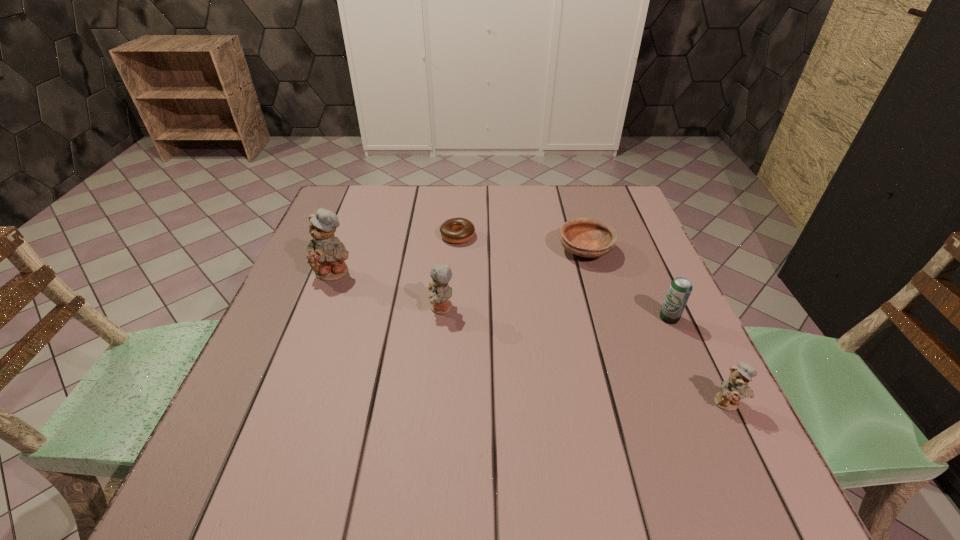
Find the location of a particular element. This screenshot has width=960, height=540. teddy bear present at the right edge is located at coordinates (736, 387).

I want to click on bowl at the right edge, so [x=585, y=237].

Identify the location of beer can present at the right edge. This screenshot has height=540, width=960. (680, 288).

Image resolution: width=960 pixels, height=540 pixels. Find the location of `object that is at the near right corner`. object that is at the near right corner is located at coordinates (736, 387).

Where is `free space at the far edge of the desktop`? free space at the far edge of the desktop is located at coordinates (562, 193).

Where is `vacant space at the near edge of the desktop`? The height and width of the screenshot is (540, 960). vacant space at the near edge of the desktop is located at coordinates (612, 440).

The image size is (960, 540). What are the coordinates of `vacant space at the left edge` in the screenshot? It's located at (327, 361).

This screenshot has height=540, width=960. I want to click on vacant space at the right edge of the desktop, so click(646, 249).

In the image, there is a desktop. Find the location of `free space at the far left corner`. free space at the far left corner is located at coordinates (367, 219).

The image size is (960, 540). Find the location of `vacant area between the beer can and the doughnut`. vacant area between the beer can and the doughnut is located at coordinates (564, 277).